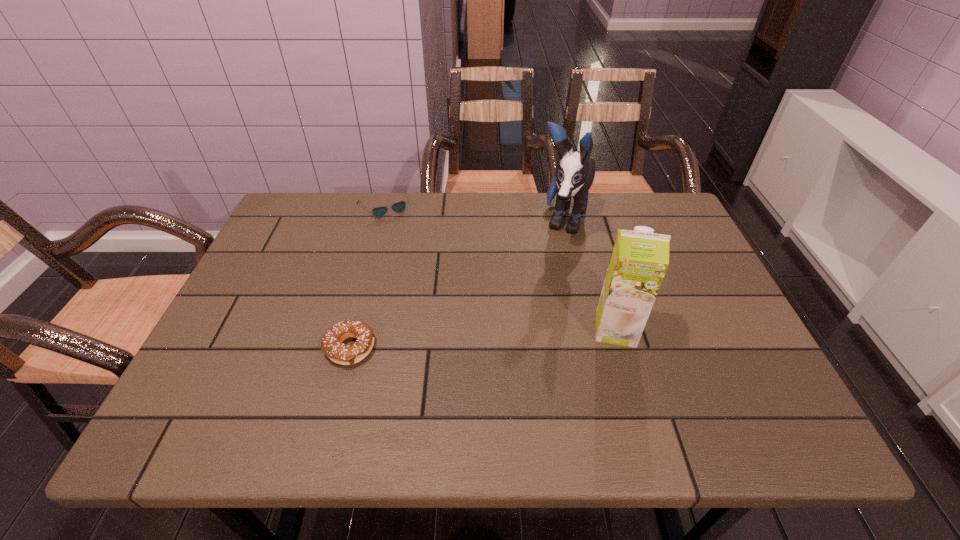
What are the coordinates of `vacant space on the desktop that is between the doughnut and the second tallest object and is positioned on the front-facing side of the tallest object` in the screenshot? It's located at (513, 336).

I want to click on vacant space on the desktop that is between the doughnut and the soya milk and is positioned on the lenses of the shortest object, so click(x=454, y=341).